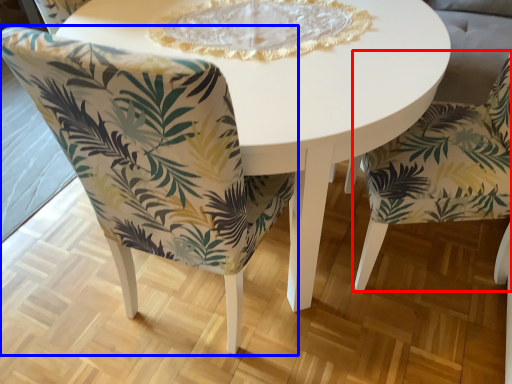
Question: Which point is further to the camera, chair (highlighted by a red box) or chair (highlighted by a blue box)?

Choices:
 (A) chair
 (B) chair

Answer: (A)